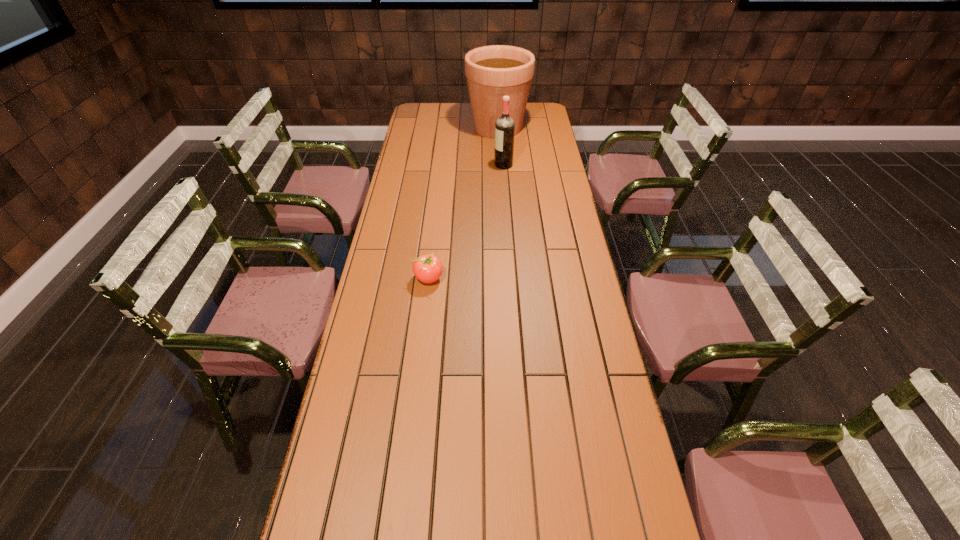
Image resolution: width=960 pixels, height=540 pixels. What are the coordinates of `object positioned at the left edge` in the screenshot? It's located at (427, 268).

In order to click on object at the right edge in this screenshot , I will do `click(494, 71)`.

Find the location of a particular element. The image size is (960, 540). object that is at the far right corner is located at coordinates (494, 71).

Find the location of a particular element. Image resolution: width=960 pixels, height=540 pixels. vacant region at the far edge of the desktop is located at coordinates [x=447, y=105].

I want to click on free space at the left edge of the desktop, so tap(381, 379).

You are a GUI agent. You are given a task and a screenshot of the screen. Output one action in this format:
    pyautogui.click(x=<x>, y=<y>)
    Task: Click on the vacant space at the right edge
    Image resolution: width=960 pixels, height=540 pixels.
    Given the screenshot: What is the action you would take?
    pyautogui.click(x=588, y=367)

I want to click on vacant space at the far left corner, so click(441, 103).

Locate an element on the screen. The width and height of the screenshot is (960, 540). free space between the flowerpot and the nearest object is located at coordinates (464, 203).

Locate an element on the screen. The image size is (960, 540). empty space that is in between the tomato and the farthest object is located at coordinates (464, 203).

Find the location of `free spot between the leftmost object and the farthest object`. free spot between the leftmost object and the farthest object is located at coordinates (464, 203).